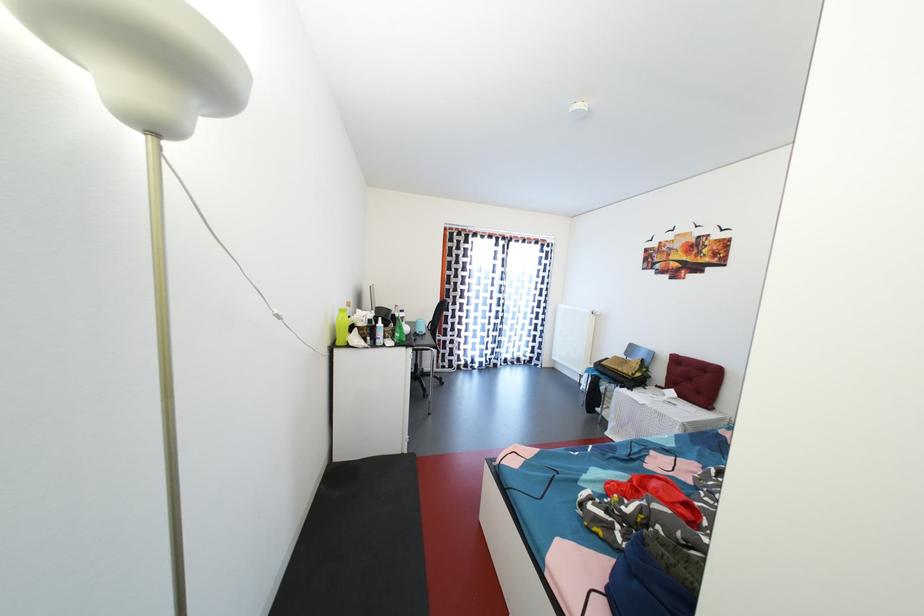
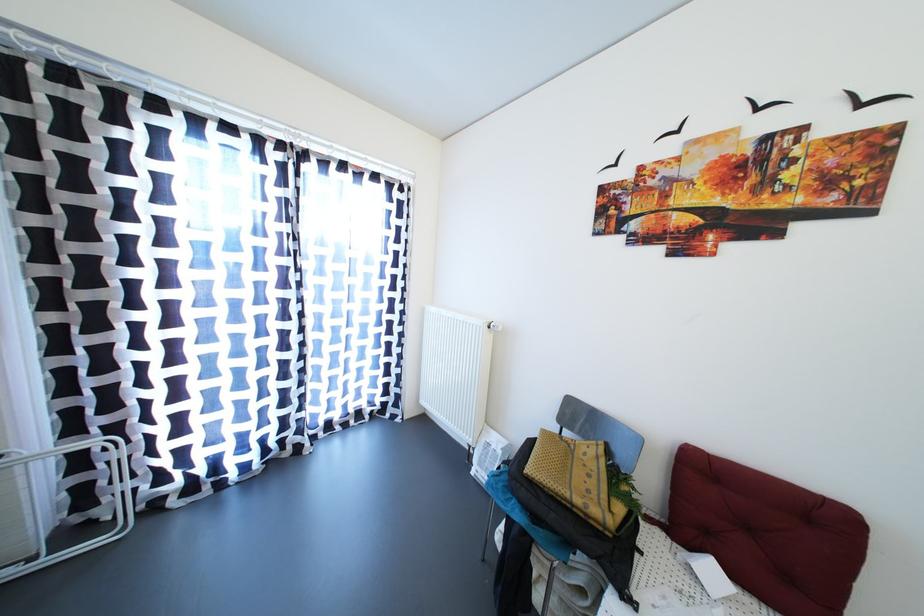
The point at (561,363) is marked in the first image. Where is the corresponding point in the second image?

(430, 407)